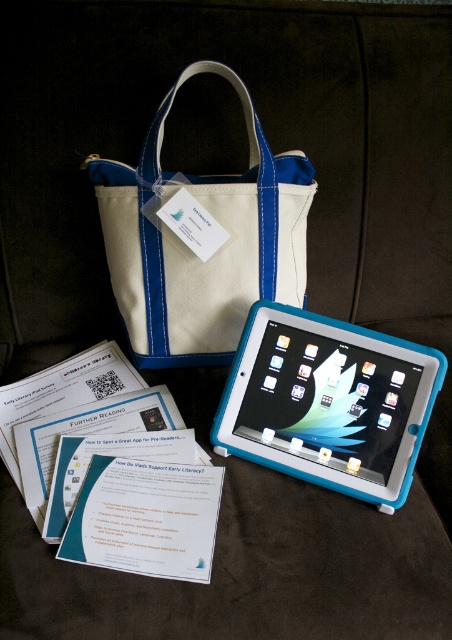
Does white canvas tote at upper center come behind blue rubberized tablet at center?

Yes, it is.

Who is shorter, white canvas tote at upper center or blue rubberized tablet at center?

With less height is blue rubberized tablet at center.

At what (x,y) coordinates should I click in order to perform the action: click on white canvas tote at upper center. Please return your answer as a coordinate pair (x, y). Looking at the image, I should click on (202, 241).